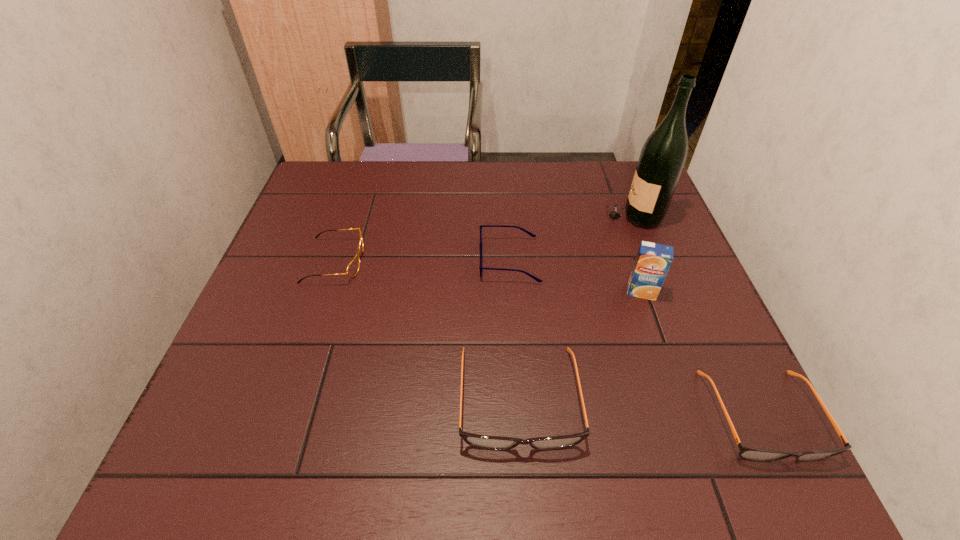
Where is `free spot between the fifth shortest object and the wine bottle`? free spot between the fifth shortest object and the wine bottle is located at coordinates (636, 253).

Image resolution: width=960 pixels, height=540 pixels. I want to click on free point between the orange_juice and the tallest object, so click(x=636, y=253).

Identify which object is the nearest to the rightmost spectacles. Please provide its 2D coordinates. Your answer should be formatted as a tuple, i.e. [(x, y)], where the tuple contains the x and y coordinates of a point satisfying the conditions above.

[(653, 260)]

Where is `the fifth closest object relative to the third tallest object`? The height and width of the screenshot is (540, 960). the fifth closest object relative to the third tallest object is located at coordinates (662, 158).

This screenshot has height=540, width=960. I want to click on spectacles that stands as the second closest to the tallest spectacles, so [x=750, y=453].

Point out which spectacles is positioned as the fourth nearest to the farthest object. Please provide its 2D coordinates. Your answer should be formatted as a tuple, i.e. [(x, y)], where the tuple contains the x and y coordinates of a point satisfying the conditions above.

[(352, 269)]

This screenshot has height=540, width=960. What are the coordinates of `blank space that satisfies the following two spatial constraints: 1. on the front-facing side of the leftmost spectacles; 2. on the right side of the fifth shortest object` in the screenshot? It's located at (325, 292).

I want to click on vacant space that satisfies the following two spatial constraints: 1. on the front-facing side of the leftmost spectacles; 2. on the left side of the orange_juice, so click(325, 292).